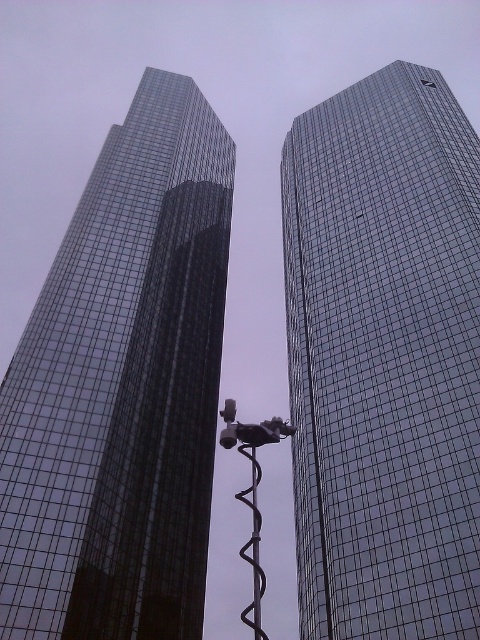
You are a photographer planning to capture both the glassy reflective skyscraper at right and the glassy reflective skyscraper at left in a single frame. Given that your camera can only focus on one building at a time, which building should you prioritize to ensure the larger one is sharp?

The glassy reflective skyscraper at right is larger than the glassy reflective skyscraper at left, so you should prioritize focusing on the glassy reflective skyscraper at right to ensure the larger building is sharp.

You are a delivery drone that needs to fly between the two glassy reflective skyscraper at right and the other skyscraper. What is the minimum horizontal distance you must maintain between the two buildings to ensure safe passage?

The minimum horizontal distance you must maintain between the two glassy reflective skyscraper at right and the other skyscraper is 46.79 meters to ensure safe passage.

You are a photographer trying to capture a clear shot of the black rubber pole at center without the glassy reflective skyscraper at left obstructing it. Based on their positions, is this possible?

The glassy reflective skyscraper at left is positioned over the black rubber pole at center, so it would obstruct the view. To capture the pole clearly, you would need to adjust your angle or position to avoid the skyscraper.